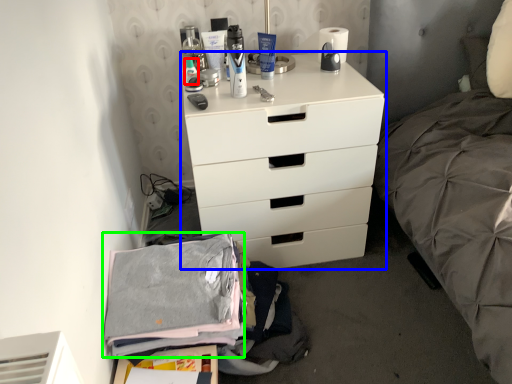
Question: Which is nearer to the toiletry (highlighted by a red box)? chest of drawers (highlighted by a blue box) or clothing (highlighted by a green box).

Choices:
 (A) chest of drawers
 (B) clothing

Answer: (A)